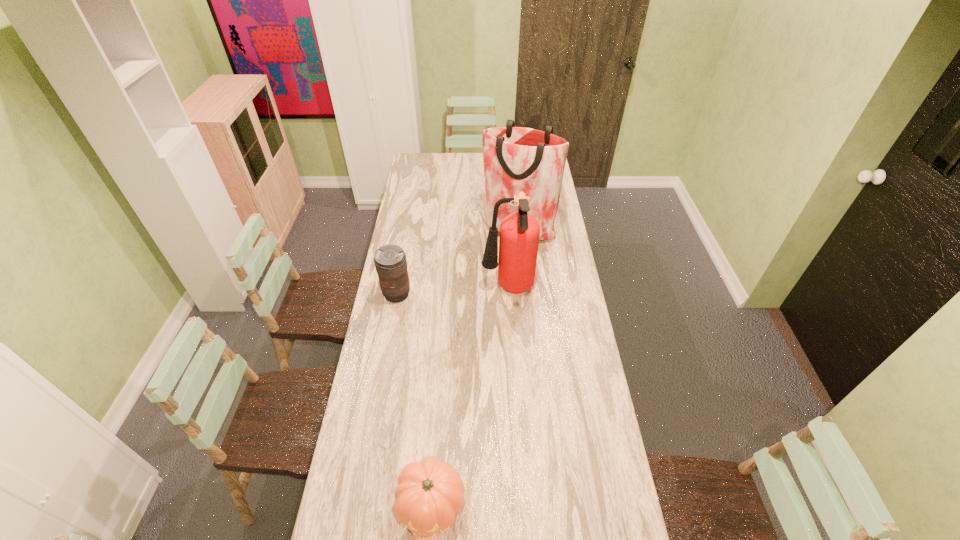
This screenshot has height=540, width=960. Find the location of `object situated at the right edge`. object situated at the right edge is located at coordinates (515, 159).

Locate an element on the screen. free space at the left edge is located at coordinates (374, 460).

Identify the location of free location at the right edge. (567, 459).

In order to click on vacant space at the far left corner in this screenshot , I will do `click(412, 155)`.

What are the coordinates of `free point between the leftmost object and the fire extinguisher` in the screenshot? It's located at pyautogui.click(x=452, y=292).

You are a GUI agent. You are given a task and a screenshot of the screen. Output one action in this format:
    pyautogui.click(x=<x>, y=<y>)
    Task: Click on the vacant space in between the fire extinguisher and the leftmost object
    This screenshot has height=540, width=960.
    Given the screenshot: What is the action you would take?
    pyautogui.click(x=452, y=292)

You are a GUI agent. You are given a task and a screenshot of the screen. Output one action in this format:
    pyautogui.click(x=<x>, y=<y>)
    Task: Click on the free space between the fire extinguisher and the leftmost object
    The width and height of the screenshot is (960, 540).
    Given the screenshot: What is the action you would take?
    pyautogui.click(x=452, y=292)

Point out which object is positioned as the second nearest to the third object from right to left. Please provide its 2D coordinates. Your answer should be formatted as a tuple, i.e. [(x, y)], where the tuple contains the x and y coordinates of a point satisfying the conditions above.

[(390, 261)]

Image resolution: width=960 pixels, height=540 pixels. What are the coordinates of `object that can be found as the second closest to the leftmost object` in the screenshot? It's located at (515, 159).

Image resolution: width=960 pixels, height=540 pixels. I want to click on vacant area in the image that satisfies the following two spatial constraints: 1. at the nozzle of the fire extinguisher; 2. on the side of the telephoto lens where the control switches are located, so click(x=508, y=294).